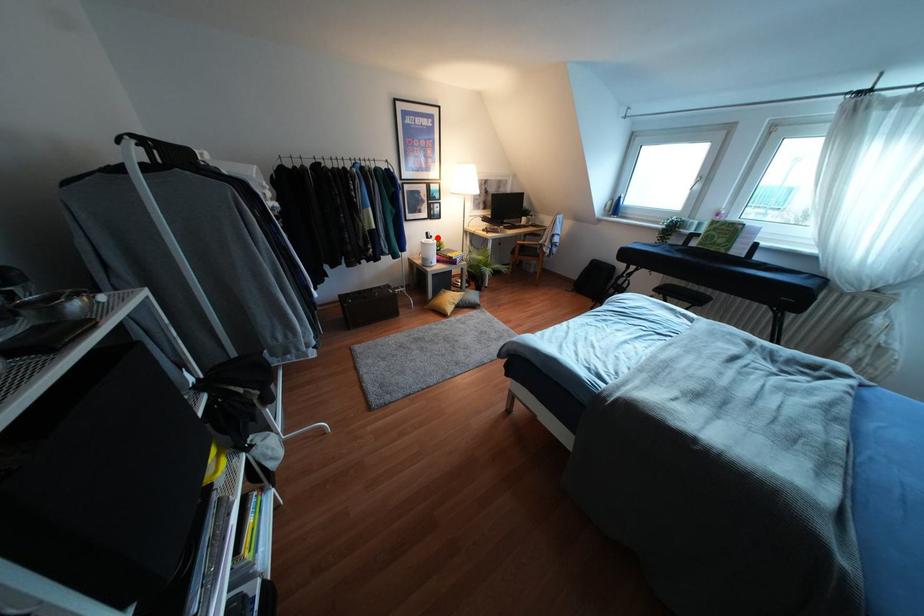
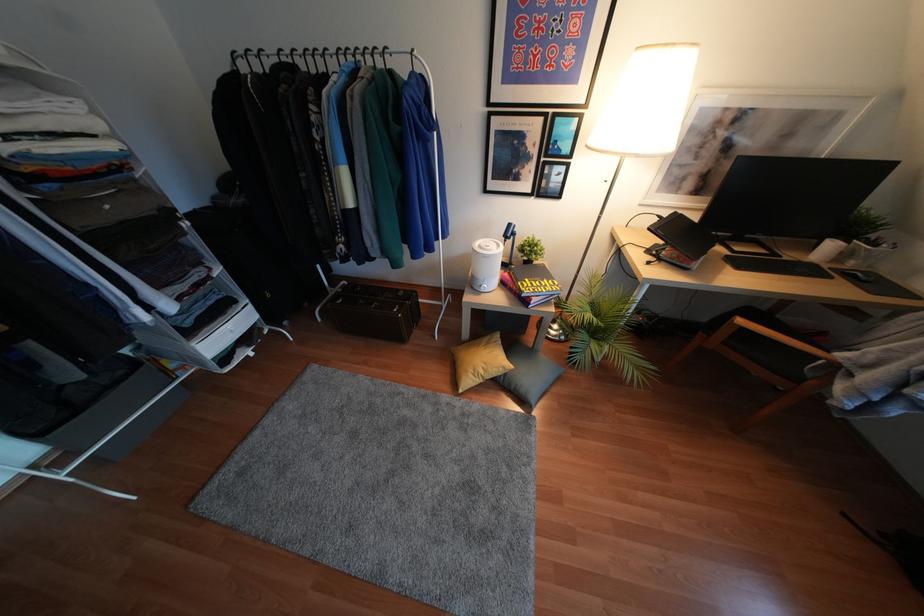
Locate, in the second image, the point that corresponds to the highlighted location in the first image.

(536, 237)